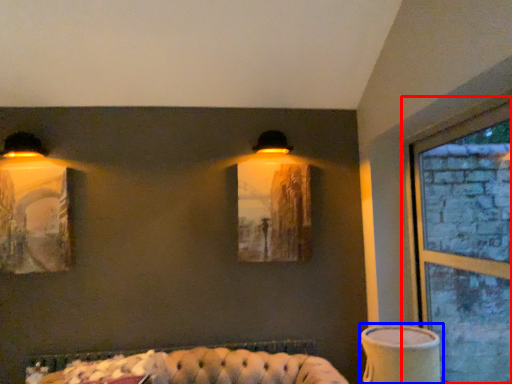
Question: Which object is further to the camera taking this photo, window (highlighted by a red box) or table lamp (highlighted by a blue box)?

Choices:
 (A) window
 (B) table lamp

Answer: (B)